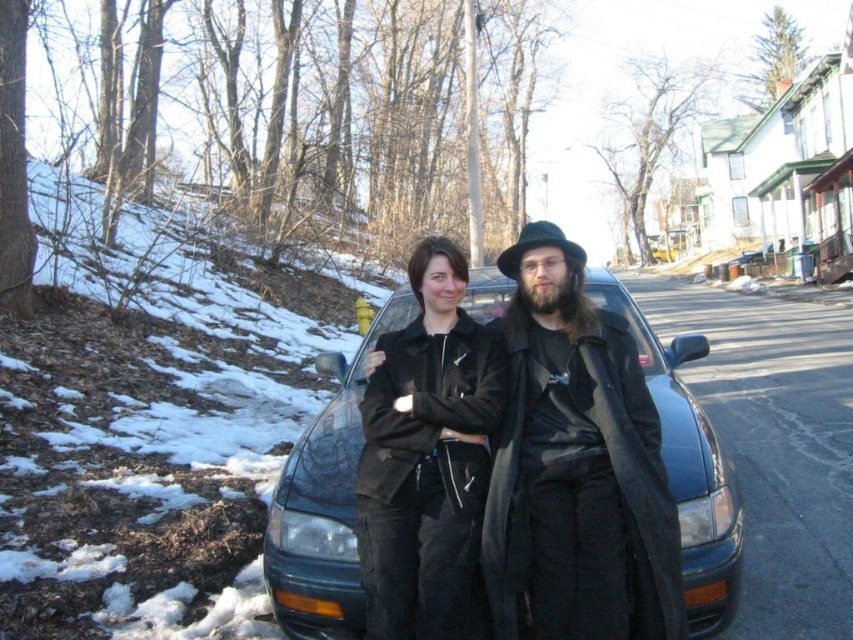
Question: Among these points, which one is farthest from the camera?

Choices:
 (A) (624, 560)
 (B) (454, 554)
 (C) (682, 449)

Answer: (C)

Question: Can you confirm if black matte coat at center is wider than shiny black car at center?

Choices:
 (A) yes
 (B) no

Answer: (B)

Question: Where is shiny black car at center located in relation to black matte jacket at center in the image?

Choices:
 (A) above
 (B) below

Answer: (A)

Question: Can you confirm if shiny black car at center is positioned to the left of black matte jacket at center?

Choices:
 (A) yes
 (B) no

Answer: (B)

Question: Among these points, which one is nearest to the camera?

Choices:
 (A) (589, 566)
 (B) (489, 401)

Answer: (A)

Question: Which of the following is the farthest from the observer?

Choices:
 (A) black matte jacket at center
 (B) shiny black car at center
 (C) black matte coat at center

Answer: (B)